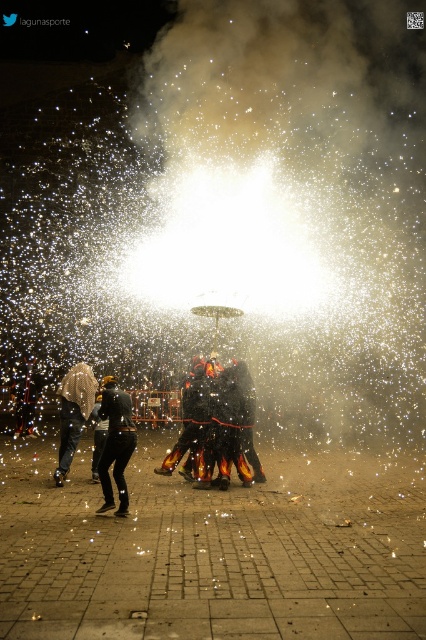
You are a photographer trying to capture the fireworks display. You notice two elements in the lower left corner of your frame. One is the black matte pants at lower left and the other is the fuzzy white hair at lower left. Which of these two items takes up more space in the photo?

The black matte pants at lower left takes up more space in the photo because its width surpasses that of the fuzzy white hair at lower left.